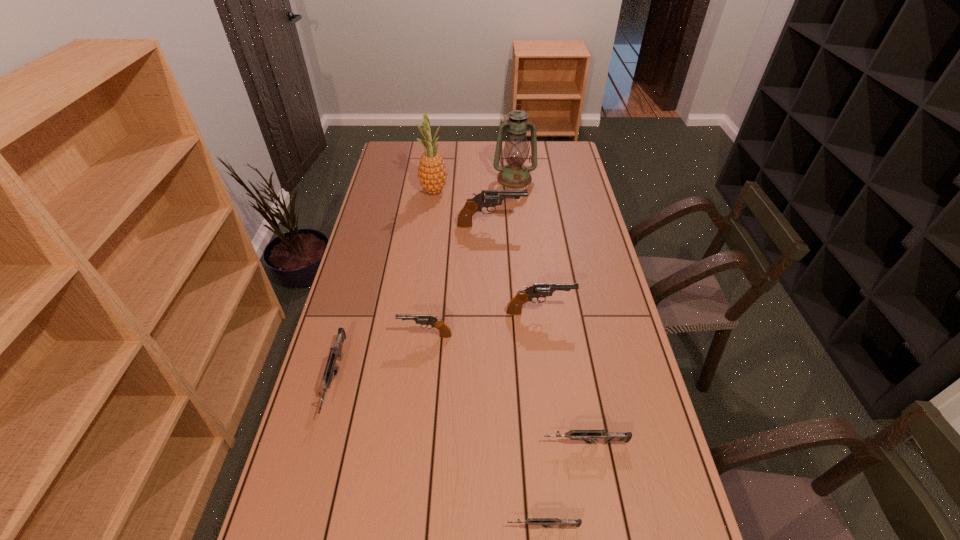
Find the location of a particular element. The image size is (960, 540). the second nearest grey gun is located at coordinates (592, 435).

At what (x,y) coordinates should I click in order to perform the action: click on the second smallest grey gun. Please return your answer as a coordinate pair (x, y). The image size is (960, 540). Looking at the image, I should click on (592, 435).

What are the coordinates of `the smallest grey gun` in the screenshot? It's located at (543, 522).

Locate an element on the screen. The height and width of the screenshot is (540, 960). the nearest grey gun is located at coordinates (543, 522).

You are a GUI agent. You are given a task and a screenshot of the screen. Output one action in this format:
    pyautogui.click(x=<x>, y=<y>)
    Task: Click on the blank area located on the left of the pineapple
    Image resolution: width=960 pixels, height=540 pixels.
    Given the screenshot: What is the action you would take?
    pyautogui.click(x=405, y=191)

Locate an element on the screen. This screenshot has width=960, height=540. free location located 0.130m on the front of the oil lamp is located at coordinates (517, 206).

The image size is (960, 540). What are the coordinates of `free location located along the barrel of the biggest black gun` in the screenshot? It's located at (542, 225).

Where is `vacant space located along the barrel of the fifth farthest object`? vacant space located along the barrel of the fifth farthest object is located at coordinates (335, 336).

The height and width of the screenshot is (540, 960). Find the location of `blank space located 0.170m along the barrel of the fifth farthest object`. blank space located 0.170m along the barrel of the fifth farthest object is located at coordinates (345, 336).

Image resolution: width=960 pixels, height=540 pixels. I want to click on free location located along the barrel of the fifth farthest object, so click(348, 336).